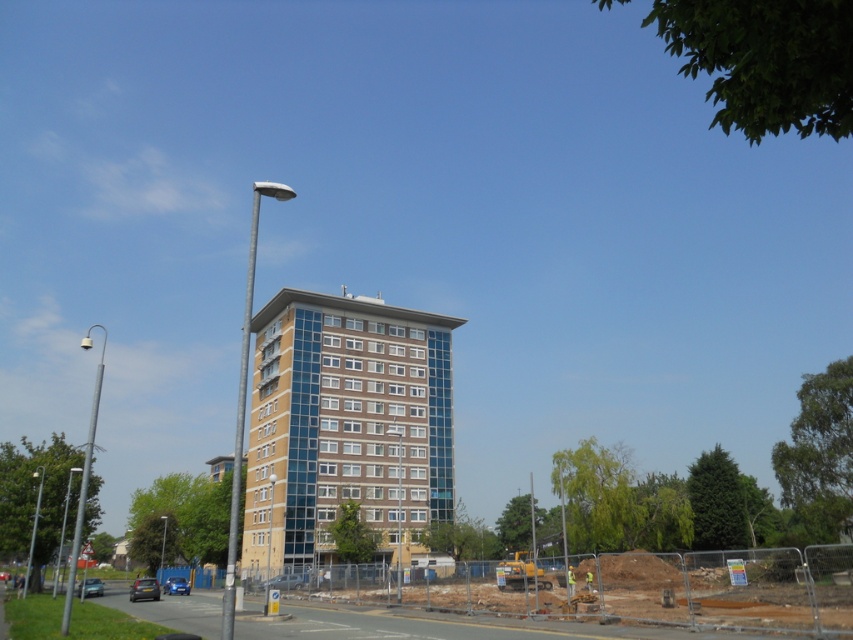
Is brown glass building at center taller than brown earth at lower center?

Yes, brown glass building at center is taller than brown earth at lower center.

Is brown glass building at center to the right of brown earth at lower center from the viewer's perspective?

In fact, brown glass building at center is to the left of brown earth at lower center.

Is point (440, 440) in front of point (721, 572)?

No, it is not.

The image size is (853, 640). In order to click on brown glass building at center in this screenshot , I will do `click(345, 422)`.